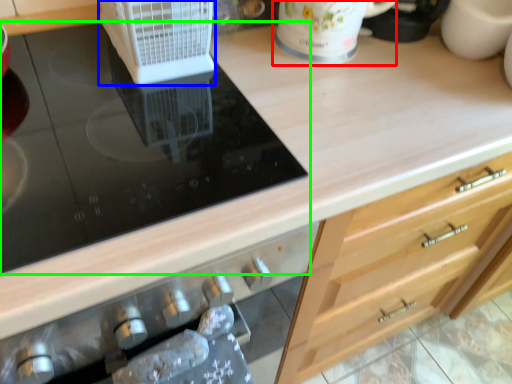
Question: Which object is the farthest from mug (highlighted by a red box)? Choose among these: kitchen appliance (highlighted by a blue box) or gas stove (highlighted by a green box).

Choices:
 (A) kitchen appliance
 (B) gas stove

Answer: (B)